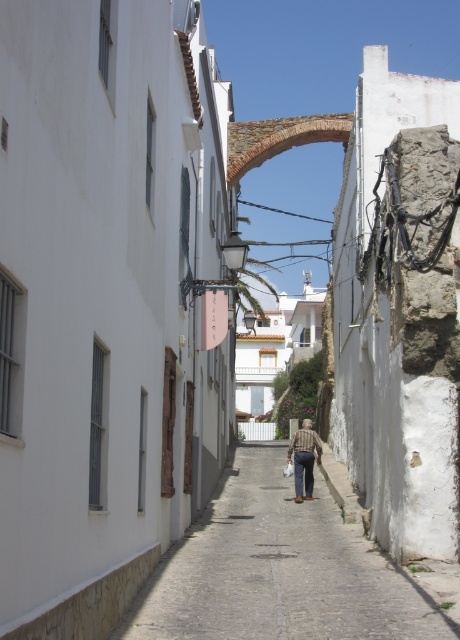
Is white painted building at center below brown textured shirt at center?

Actually, white painted building at center is above brown textured shirt at center.

Is white painted building at center to the left of brown textured shirt at center from the viewer's perspective?

No, white painted building at center is not to the left of brown textured shirt at center.

Who is more distant from viewer, (x=266, y=314) or (x=310, y=436)?

Point (x=266, y=314)

At what (x,y) coordinates should I click in order to perform the action: click on white painted building at center. Please return your answer as a coordinate pair (x, y). The width and height of the screenshot is (460, 640). Looking at the image, I should click on (276, 348).

Which is behind, point (162, 632) or point (291, 324)?

The point (291, 324) is more distant.

Who is lower down, cobblestone path at center or white painted building at center?

cobblestone path at center is below.

Measure the distance between point (329, 500) and camera.

Point (329, 500) and camera are 24.93 meters apart from each other.

Where is `cobblestone path at center`? This screenshot has height=640, width=460. cobblestone path at center is located at coordinates (277, 570).

In the scene shown: Can you confirm if cobblestone path at center is thinner than brown textured shirt at center?

In fact, cobblestone path at center might be wider than brown textured shirt at center.

Between point (343, 588) and point (295, 490), which one is positioned in front?

Point (343, 588) is more forward.

Between point (274, 451) and point (310, 433), which one is positioned behind?

Positioned behind is point (274, 451).

Image resolution: width=460 pixels, height=640 pixels. I want to click on cobblestone path at center, so click(277, 570).